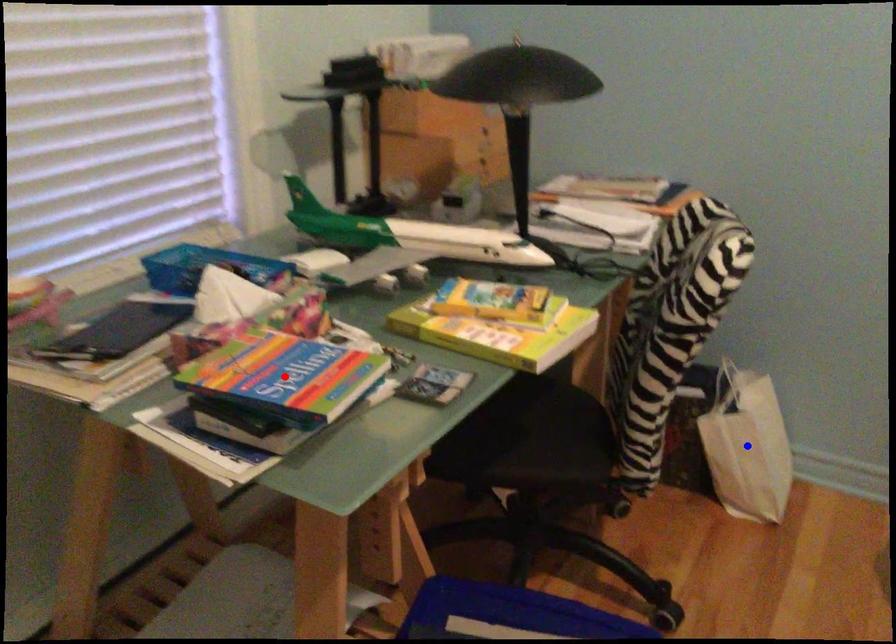
Question: Which of the two points in the image is closer to the camera?

Choices:
 (A) Blue point is closer.
 (B) Red point is closer.

Answer: (B)